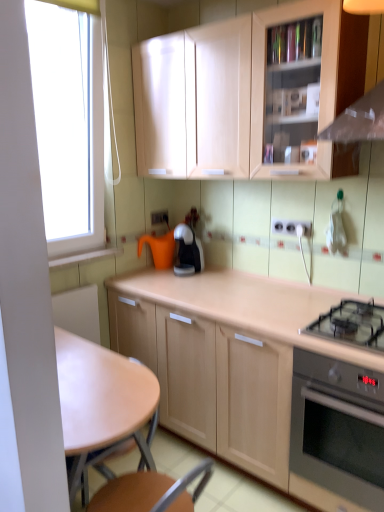
The height and width of the screenshot is (512, 384). Find the location of `white plastic electric outlet at center, placed as the 2th electric outlet when sorted from right to left`. white plastic electric outlet at center, placed as the 2th electric outlet when sorted from right to left is located at coordinates pyautogui.click(x=159, y=217).

This screenshot has height=512, width=384. What do you see at coordinates (352, 324) in the screenshot?
I see `black glass gas stove at lower right` at bounding box center [352, 324].

Identify the location of matte wood cabinet at upper center, placed as the 2th cabinetry when sorted from bottom to top. The height and width of the screenshot is (512, 384). (227, 91).

Measure the distance between point (141, 369) and camera.

They are 5.06 feet apart.

This screenshot has height=512, width=384. In order to click on orange matte watering can at center in this screenshot , I will do [159, 249].

What are the coordinates of `white plastic electric outlet at center, the 2th electric outlet in the bottom-to-top sequence` in the screenshot? It's located at (159, 217).

Is light wood cabinet at center, acting as the 1th cabinetry starting from the bottom, facing towards black glass gas stove at lower right?

No, light wood cabinet at center, acting as the 1th cabinetry starting from the bottom, is not facing towards black glass gas stove at lower right.

Does light wood cabinet at center, acting as the 2th cabinetry starting from the top, lie in front of black glass gas stove at lower right?

Yes, it is in front of black glass gas stove at lower right.

Looking at their sizes, would you say light wood cabinet at center, acting as the 1th cabinetry starting from the bottom, is wider or thinner than black glass gas stove at lower right?

In the image, light wood cabinet at center, acting as the 1th cabinetry starting from the bottom, appears to be wider than black glass gas stove at lower right.

Is point (241, 66) closer or farther from the camera than point (327, 301)?

Clearly, point (241, 66) is closer to the camera than point (327, 301).

From a real-world perspective, is matte wood cabinet at upper center, placed as the 1th cabinetry when sorted from top to bottom, above or below light wood cabinet at center, acting as the 1th cabinetry starting from the bottom?

From a real-world perspective, matte wood cabinet at upper center, placed as the 1th cabinetry when sorted from top to bottom, is physically above light wood cabinet at center, acting as the 1th cabinetry starting from the bottom.

In the scene shown: Would you say matte wood cabinet at upper center, placed as the 2th cabinetry when sorted from bottom to top, is to the left or to the right of light wood cabinet at center, acting as the 2th cabinetry starting from the top, in the picture?

In the image, matte wood cabinet at upper center, placed as the 2th cabinetry when sorted from bottom to top, appears on the left side of light wood cabinet at center, acting as the 2th cabinetry starting from the top.

The image size is (384, 512). What are the coordinates of `cabinetry above the light wood cabinet at center, acting as the 2th cabinetry starting from the top (from the image's perspective)` in the screenshot? It's located at (227, 91).

In terms of width, does white plastic electric outlet at center, marked as the 1th electric outlet in a back-to-front arrangement, look wider or thinner when compared to orange matte watering can at center?

Considering their sizes, white plastic electric outlet at center, marked as the 1th electric outlet in a back-to-front arrangement, looks slimmer than orange matte watering can at center.

Between white plastic electric outlet at center, the 2th electric outlet in the bottom-to-top sequence, and orange matte watering can at center, which one has less height?

white plastic electric outlet at center, the 2th electric outlet in the bottom-to-top sequence, is shorter.

From the image's perspective, which one is positioned lower, white plastic electric outlet at center, which ranks as the first electric outlet in left-to-right order, or orange matte watering can at center?

orange matte watering can at center appears lower in the image.

In the scene shown: Is light brown wooden table at center looking in the opposite direction of white plastic electrical outlet at center, the 2th electric outlet viewed from the top?

Yes, white plastic electrical outlet at center, the 2th electric outlet viewed from the top, is at the back of light brown wooden table at center.

I want to click on the 2nd electric outlet directly above the light brown wooden table at center (from a real-world perspective), so click(x=291, y=227).

Are light brown wooden table at center and white plastic electrical outlet at center, marked as the second electric outlet in a back-to-front arrangement, making contact?

No, light brown wooden table at center is not touching white plastic electrical outlet at center, marked as the second electric outlet in a back-to-front arrangement.

In terms of width, does light brown wooden table at center look wider or thinner when compared to white plastic electrical outlet at center, which appears as the 1th electric outlet when viewed from the right?

In the image, light brown wooden table at center appears to be wider than white plastic electrical outlet at center, which appears as the 1th electric outlet when viewed from the right.

Is black glossy coffee maker at center completely or partially outside of white plastic electric outlet at center, the 2th electric outlet in the bottom-to-top sequence?

Absolutely, black glossy coffee maker at center is external to white plastic electric outlet at center, the 2th electric outlet in the bottom-to-top sequence.

Which object is wider, black glossy coffee maker at center or white plastic electric outlet at center, which ranks as the first electric outlet in left-to-right order?

With larger width is black glossy coffee maker at center.

From the image's perspective, is black glossy coffee maker at center beneath white plastic electric outlet at center, which ranks as the first electric outlet in left-to-right order?

Correct, black glossy coffee maker at center appears lower than white plastic electric outlet at center, which ranks as the first electric outlet in left-to-right order, in the image.

From a real-world perspective, is black glossy coffee maker at center below white plastic electric outlet at center, which is the 1th electric outlet from top to bottom?

Yes, from a real-world perspective, black glossy coffee maker at center is below white plastic electric outlet at center, which is the 1th electric outlet from top to bottom.

Is black glass gas stove at lower right facing towards orange matte watering can at center?

No, black glass gas stove at lower right is not oriented towards orange matte watering can at center.

Which is correct: black glass gas stove at lower right is inside orange matte watering can at center, or outside of it?

black glass gas stove at lower right cannot be found inside orange matte watering can at center.

Can you tell me how much black glass gas stove at lower right and orange matte watering can at center differ in facing direction?

black glass gas stove at lower right and orange matte watering can at center are facing 5.86 degrees away from each other.

Considering the positions of objects black glass gas stove at lower right and orange matte watering can at center in the image provided, who is more to the left, black glass gas stove at lower right or orange matte watering can at center?

From the viewer's perspective, orange matte watering can at center appears more on the left side.

Considering the relative sizes of light wood cabinet at center, acting as the 1th cabinetry starting from the bottom, and matte wood cabinet at upper center, placed as the 2th cabinetry when sorted from bottom to top, in the image provided, is light wood cabinet at center, acting as the 1th cabinetry starting from the bottom, thinner than matte wood cabinet at upper center, placed as the 2th cabinetry when sorted from bottom to top,?

No.

Is light wood cabinet at center, acting as the 2th cabinetry starting from the top, looking in the opposite direction of matte wood cabinet at upper center, placed as the 1th cabinetry when sorted from top to bottom?

No, matte wood cabinet at upper center, placed as the 1th cabinetry when sorted from top to bottom, is not at the back of light wood cabinet at center, acting as the 2th cabinetry starting from the top.

Which is further, [290,330] or [256,57]?

The point [256,57] is more distant.

From a real-world perspective, is light wood cabinet at center, acting as the 1th cabinetry starting from the bottom, positioned above or below matte wood cabinet at upper center, placed as the 2th cabinetry when sorted from bottom to top?

light wood cabinet at center, acting as the 1th cabinetry starting from the bottom, is situated lower than matte wood cabinet at upper center, placed as the 2th cabinetry when sorted from bottom to top, in the real world.

Locate an element on the screen. Image resolution: width=384 pixels, height=512 pixels. gas stove above the light wood cabinet at center, acting as the 2th cabinetry starting from the top (from a real-world perspective) is located at coordinates (352, 324).

Locate an element on the screen. cabinetry on the left of the light wood cabinet at center, acting as the 2th cabinetry starting from the top is located at coordinates (227, 91).

Looking at this image, looking at the image, which one is located further to black glossy coffee maker at center, black glass gas stove at lower right or orange matte watering can at center?

Based on the image, black glass gas stove at lower right appears to be further to black glossy coffee maker at center.

Looking at the image, which one is located further to stainless steel oven at lower right, orange matte watering can at center or light brown wooden table at center?

Based on the image, orange matte watering can at center appears to be further to stainless steel oven at lower right.

Looking at the image, which one is located further to light brown wooden table at center, black glass gas stove at lower right or white plastic electrical outlet at center, which appears as the 1th electric outlet when viewed from the right?

Result: Among the two, white plastic electrical outlet at center, which appears as the 1th electric outlet when viewed from the right, is located further to light brown wooden table at center.

Looking at the image, which one is located further to black glass gas stove at lower right, light brown wooden table at center or black glossy coffee maker at center?

Based on the image, black glossy coffee maker at center appears to be further to black glass gas stove at lower right.

Based on their spatial positions, is white plastic electrical outlet at center, the 2th electric outlet viewed from the top, or light brown wooden table at center closer to white plastic electric outlet at center, the 2th electric outlet in the bottom-to-top sequence?

The object closer to white plastic electric outlet at center, the 2th electric outlet in the bottom-to-top sequence, is white plastic electrical outlet at center, the 2th electric outlet viewed from the top.

When comparing their distances from orange matte watering can at center, does white plastic electrical outlet at center, marked as the second electric outlet in a back-to-front arrangement, or light brown wooden table at center seem further?

light brown wooden table at center is further to orange matte watering can at center.

Looking at the image, which one is located further to white plastic electrical outlet at center, the 2th electric outlet viewed from the left, matte wood cabinet at upper center, placed as the 2th cabinetry when sorted from bottom to top, or light brown wooden table at center?

light brown wooden table at center lies further to white plastic electrical outlet at center, the 2th electric outlet viewed from the left, than the other object.

From the picture: Estimate the real-world distances between objects in this image. Which object is further from light wood cabinet at center, acting as the 1th cabinetry starting from the bottom, white plastic electrical outlet at center, the 2th electric outlet viewed from the left, or black glossy coffee maker at center?

The object further to light wood cabinet at center, acting as the 1th cabinetry starting from the bottom, is white plastic electrical outlet at center, the 2th electric outlet viewed from the left.

Where is `gas stove between light brown wooden table at center and black glossy coffee maker at center along the z-axis`? The image size is (384, 512). gas stove between light brown wooden table at center and black glossy coffee maker at center along the z-axis is located at coordinates (352, 324).

The height and width of the screenshot is (512, 384). In order to click on gas stove between matte wood cabinet at upper center, placed as the 1th cabinetry when sorted from top to bottom, and stainless steel oven at lower right in the up-down direction in this screenshot , I will do `click(352, 324)`.

This screenshot has height=512, width=384. Identify the location of cabinetry between white plastic electrical outlet at center, which is the 1th electric outlet in bottom-to-top order, and stainless steel oven at lower right, in the vertical direction. (249, 306).

Where is `kitchen appliance between matte wood cabinet at upper center, placed as the 2th cabinetry when sorted from bottom to top, and orange matte watering can at center in the front-back direction`? The height and width of the screenshot is (512, 384). kitchen appliance between matte wood cabinet at upper center, placed as the 2th cabinetry when sorted from bottom to top, and orange matte watering can at center in the front-back direction is located at coordinates (188, 250).